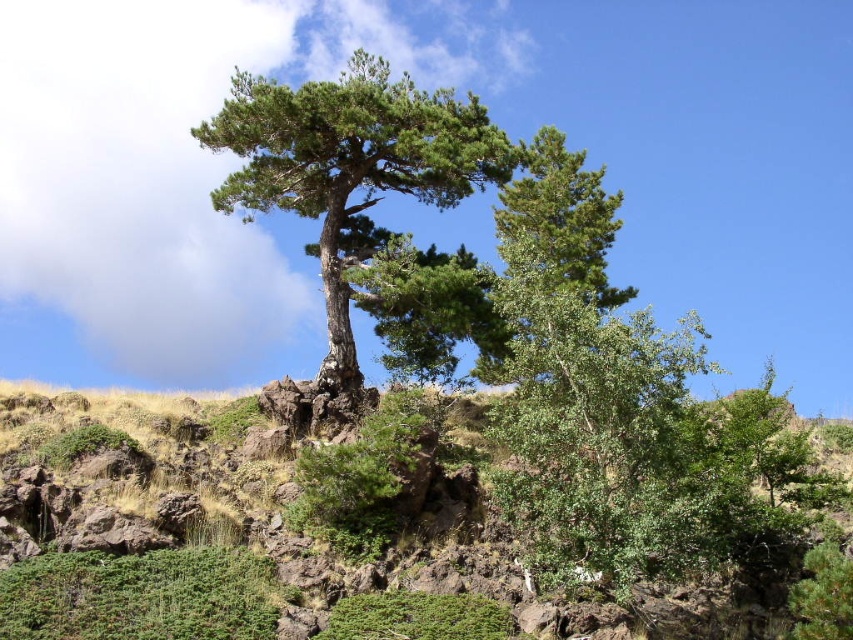
Measure the distance between green leafy shrubs at center and camera.

green leafy shrubs at center and camera are 12.92 meters apart.

Consider the image. Between green leafy shrubs at center and green textured tree at center, which one is positioned lower?

green leafy shrubs at center is below.

Does point (415, 602) come in front of point (497, 144)?

Yes, point (415, 602) is in front of point (497, 144).

Where is `green leafy shrubs at center`? The width and height of the screenshot is (853, 640). green leafy shrubs at center is located at coordinates (331, 538).